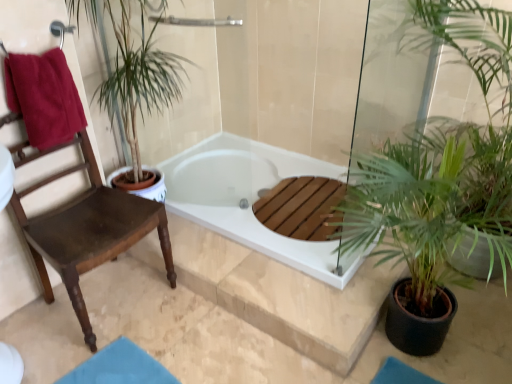
Question: From the image's perspective, is wooden chair at left above or below white glossy bathtub at center?

Choices:
 (A) above
 (B) below

Answer: (B)

Question: Considering the positions of wooden chair at left and white glossy bathtub at center in the image, is wooden chair at left wider or thinner than white glossy bathtub at center?

Choices:
 (A) wide
 (B) thin

Answer: (B)

Question: Considering the real-world distances, which object is farthest from the maroon cotton towel at left?

Choices:
 (A) green leafy plant at right
 (B) white glossy bathtub at center
 (C) wooden chair at left

Answer: (A)

Question: Which is farther from the wooden chair at left?

Choices:
 (A) maroon cotton towel at left
 (B) white glossy bathtub at center
 (C) green leafy plant at right

Answer: (C)